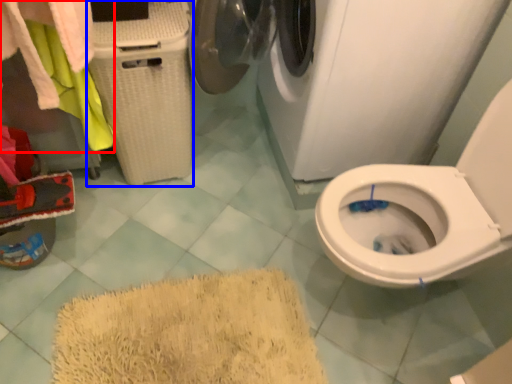
Question: Which point is further to the camera, laundry (highlighted by a red box) or laundry basket (highlighted by a blue box)?

Choices:
 (A) laundry
 (B) laundry basket

Answer: (B)